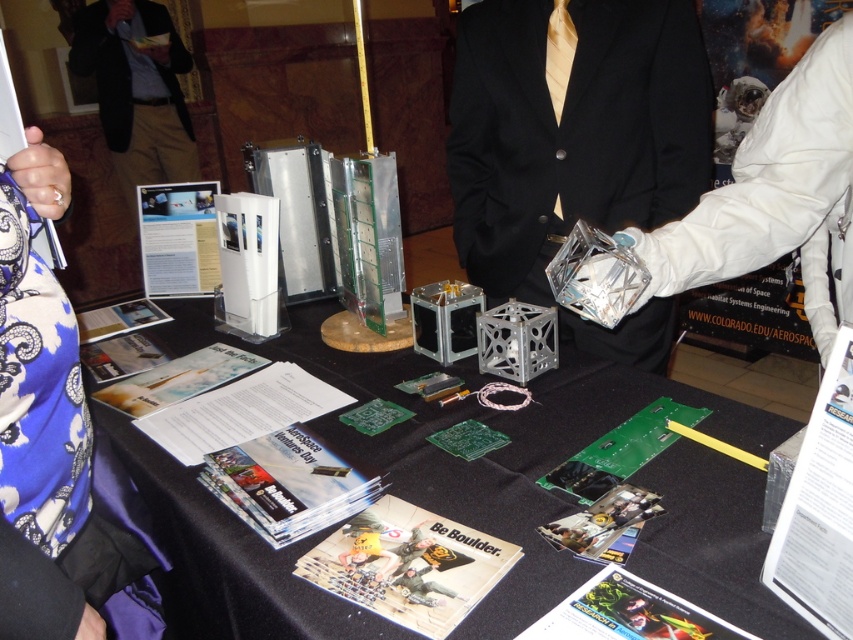
You are an attendee at the exhibition and want to know if the black suit at upper center can be placed on top of the white paper at upper left without covering the entire surface. Can you determine this based on their sizes?

The black suit at upper center has a greater height compared to the white paper at upper left. Since the black suit is taller, placing it on the white paper might cause it to extend beyond the paper, potentially covering the entire surface depending on the paper size. However, the description only mentions height, so we cannot confirm the width. Therefore, it might not fit fully, but the exact determination requires more information about the paper dimensions.

You are an attendee at the exhibition and want to place both the black suit at upper center and the white paper at upper left on a shelf that can only hold items up to the width of the wider object. Which object should you use to determine the shelf width requirement?

The black suit at upper center has a greater width than the white paper at upper left, so the shelf must be at least as wide as the black suit at upper center to accommodate both items.